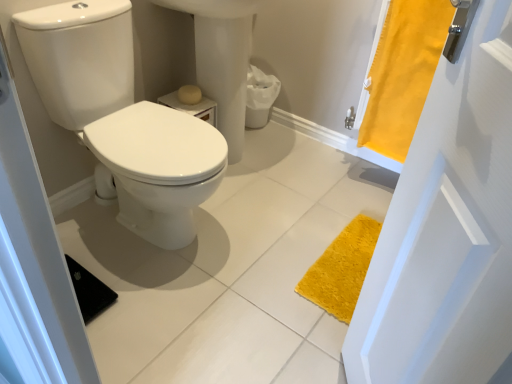
Question: From a real-world perspective, relative to white glossy sink at center, is yellow fabric curtain at right vertically above or below?

Choices:
 (A) above
 (B) below

Answer: (A)

Question: From the image's perspective, is yellow fabric curtain at right located above or below white glossy sink at center?

Choices:
 (A) below
 (B) above

Answer: (A)

Question: Which object is positioned closest to the matte yellow toilet paper at center?

Choices:
 (A) white glossy toilet at left
 (B) white glossy sink at center
 (C) yellow fabric curtain at right

Answer: (B)

Question: Which is nearer to the white glossy toilet at left?

Choices:
 (A) yellow fabric curtain at right
 (B) white glossy sink at center
 (C) matte yellow toilet paper at center

Answer: (C)